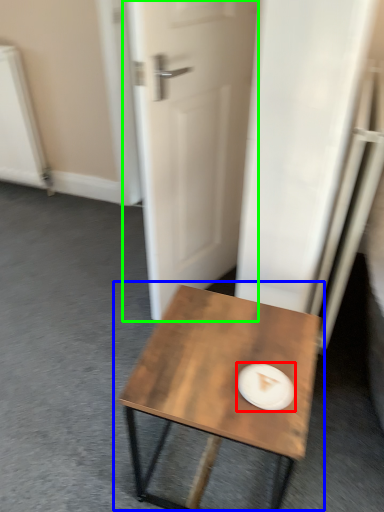
Question: Which is nearer to the paper plate (highlighted by a red box)? coffee table (highlighted by a blue box) or door (highlighted by a green box).

Choices:
 (A) coffee table
 (B) door

Answer: (A)